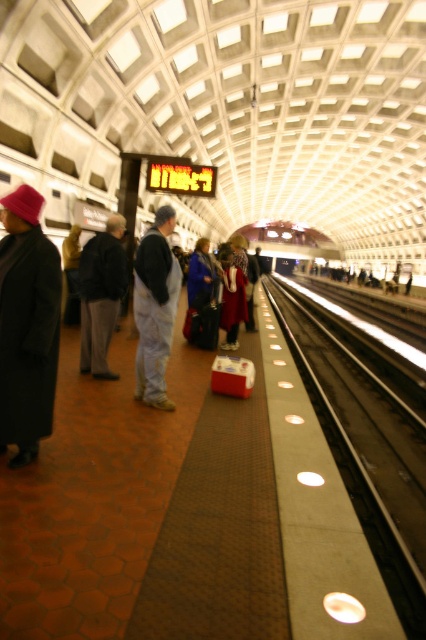
Is metal/smooth train track at center-right positioned in front of dark gray fabric jacket at left?

Yes.

Is metal/smooth train track at center-right thinner than dark gray fabric jacket at left?

In fact, metal/smooth train track at center-right might be wider than dark gray fabric jacket at left.

In order to click on metal/smooth train track at center-right in this screenshot , I will do `click(367, 456)`.